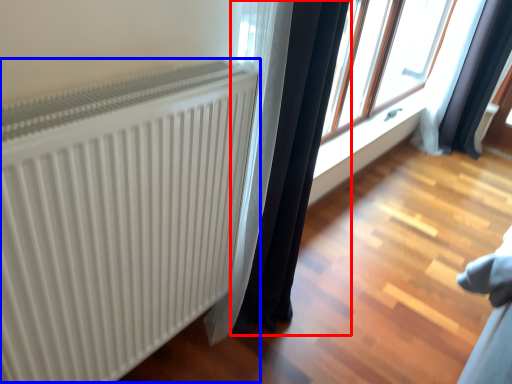
Question: Which point is further to the camera, curtain (highlighted by a red box) or radiator (highlighted by a blue box)?

Choices:
 (A) curtain
 (B) radiator

Answer: (A)